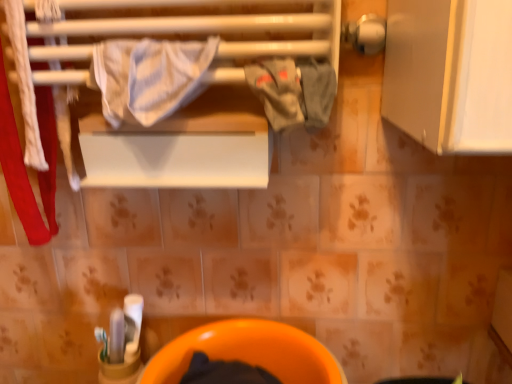
Question: Can you confirm if gray cotton cloth at center is bigger than white striped fabric at upper center?

Choices:
 (A) no
 (B) yes

Answer: (A)

Question: Can white striped fabric at upper center be found inside gray cotton cloth at center?

Choices:
 (A) yes
 (B) no

Answer: (B)

Question: Can you confirm if gray cotton cloth at center is thinner than white striped fabric at upper center?

Choices:
 (A) yes
 (B) no

Answer: (A)

Question: Is gray cotton cloth at center shorter than white striped fabric at upper center?

Choices:
 (A) no
 (B) yes

Answer: (B)

Question: Is gray cotton cloth at center smaller than white striped fabric at upper center?

Choices:
 (A) no
 (B) yes

Answer: (B)

Question: Is there a large distance between gray cotton cloth at center and white striped fabric at upper center?

Choices:
 (A) yes
 (B) no

Answer: (B)

Question: Can we say white striped fabric at upper center lies outside gray cotton cloth at center?

Choices:
 (A) yes
 (B) no

Answer: (A)

Question: Would you say gray cotton cloth at center is part of white striped fabric at upper center's contents?

Choices:
 (A) yes
 (B) no

Answer: (B)

Question: From the image's perspective, is white striped fabric at upper center above gray cotton cloth at center?

Choices:
 (A) yes
 (B) no

Answer: (A)

Question: From a real-world perspective, does white striped fabric at upper center stand above gray cotton cloth at center?

Choices:
 (A) no
 (B) yes

Answer: (B)

Question: Considering the relative sizes of white striped fabric at upper center and gray cotton cloth at center in the image provided, is white striped fabric at upper center shorter than gray cotton cloth at center?

Choices:
 (A) no
 (B) yes

Answer: (A)

Question: Can you see white striped fabric at upper center touching gray cotton cloth at center?

Choices:
 (A) yes
 (B) no

Answer: (B)

Question: Is orange glossy toilet bowl at lower center aimed at gray cotton cloth at center?

Choices:
 (A) yes
 (B) no

Answer: (B)